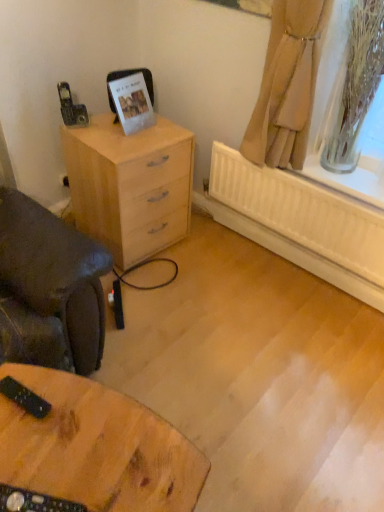
Question: Considering the relative sizes of beige fabric curtain at upper right and light wood chest of drawers at left in the image provided, is beige fabric curtain at upper right wider than light wood chest of drawers at left?

Choices:
 (A) no
 (B) yes

Answer: (A)

Question: Is beige fabric curtain at upper right positioned in front of light wood chest of drawers at left?

Choices:
 (A) no
 (B) yes

Answer: (B)

Question: Is beige fabric curtain at upper right turned away from light wood chest of drawers at left?

Choices:
 (A) no
 (B) yes

Answer: (A)

Question: Does beige fabric curtain at upper right have a larger size compared to light wood chest of drawers at left?

Choices:
 (A) no
 (B) yes

Answer: (A)

Question: Can you confirm if beige fabric curtain at upper right is taller than light wood chest of drawers at left?

Choices:
 (A) yes
 (B) no

Answer: (A)

Question: Considering their positions, is light wood chest of drawers at left located in front of or behind wooden table at lower left?

Choices:
 (A) behind
 (B) front

Answer: (A)

Question: From the image's perspective, is light wood chest of drawers at left located above or below wooden table at lower left?

Choices:
 (A) above
 (B) below

Answer: (A)

Question: Looking at the image, does light wood chest of drawers at left seem bigger or smaller compared to wooden table at lower left?

Choices:
 (A) small
 (B) big

Answer: (B)

Question: Is light wood chest of drawers at left spatially inside wooden table at lower left, or outside of it?

Choices:
 (A) inside
 (B) outside

Answer: (B)

Question: From their relative heights in the image, would you say light wood chest of drawers at left is taller or shorter than beige fabric curtain at upper right?

Choices:
 (A) short
 (B) tall

Answer: (A)

Question: From the image's perspective, is light wood chest of drawers at left positioned above or below beige fabric curtain at upper right?

Choices:
 (A) below
 (B) above

Answer: (A)

Question: Is point (135, 145) positioned closer to the camera than point (284, 66)?

Choices:
 (A) farther
 (B) closer

Answer: (A)

Question: Relative to beige fabric curtain at upper right, is light wood chest of drawers at left in front or behind?

Choices:
 (A) behind
 (B) front

Answer: (A)

Question: Does point (306, 70) appear closer or farther from the camera than point (91, 409)?

Choices:
 (A) farther
 (B) closer

Answer: (A)

Question: Is beige fabric curtain at upper right taller or shorter than wooden table at lower left?

Choices:
 (A) tall
 (B) short

Answer: (A)